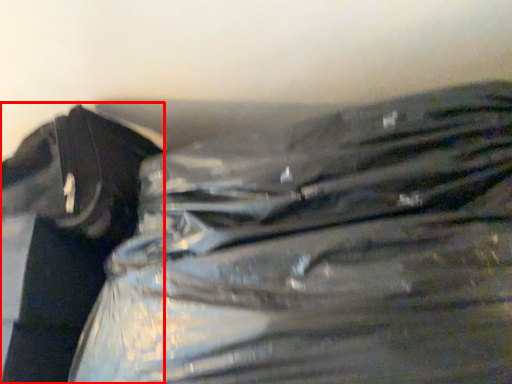
Question: From the image's perspective, considering the relative positions of waste (annotated by the red box) and plastic bag in the image provided, where is waste (annotated by the red box) located with respect to the staircase?

Choices:
 (A) below
 (B) above

Answer: (A)